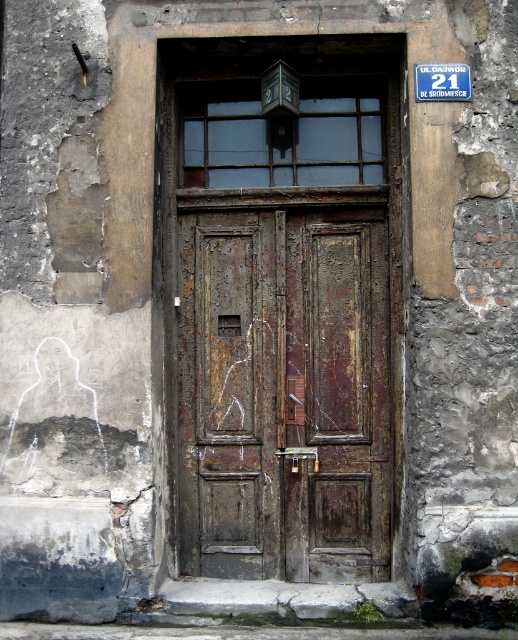
You are standing in front of the weathered wooden door and need to mail a letter. There is a mailbox and a sign nearby. Where exactly is the mailbox positioned relative to the rusty wood door at center?

The mailbox is positioned just below the small window above the rusty wood door at center. According to the description, it is a small, rectangular mailbox hanging below the window which is divided into six panes by metal bars.

You are standing in front of the weathered wooden door and need to locate two points marked on the image. The first point is at coordinates point (x=383, y=550) and the second is at point (x=427, y=81). Based on their positions, which point is closer to the door?

Point (x=383, y=550) is behind point (x=427, y=81), so the point closer to the door is point (x=427, y=81).

From the picture: You are a delivery person holding a package for address 2. You see a rusty wood door at center and a blue plastic sign at upper center. Which object should you approach first to deliver the package?

You should approach the rusty wood door at center first since it is closer to you than the blue plastic sign at upper center, which is 1.30 meters away.